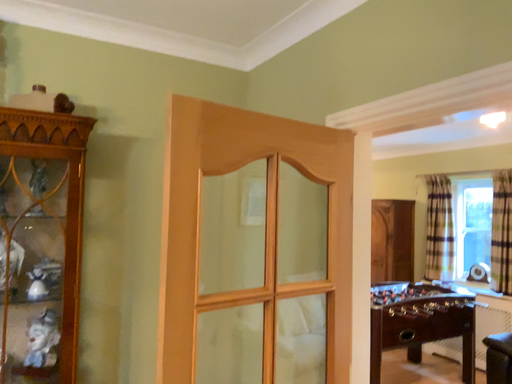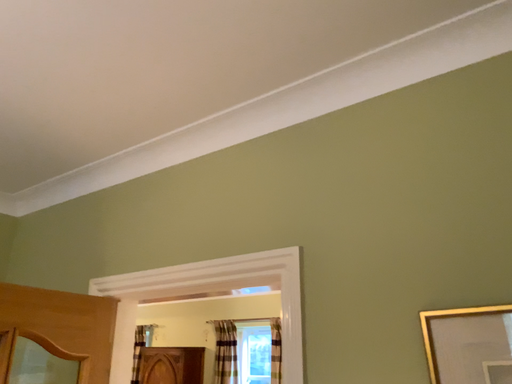
Question: How did the camera likely rotate when shooting the video?

Choices:
 (A) rotated left
 (B) rotated right

Answer: (B)